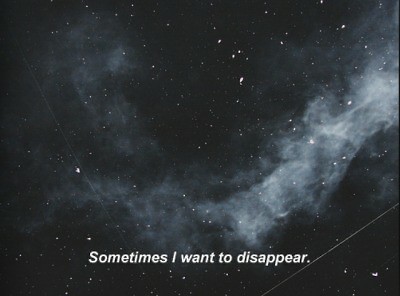
Locate an element on the screen. This screenshot has width=400, height=296. cord is located at coordinates (326, 250).